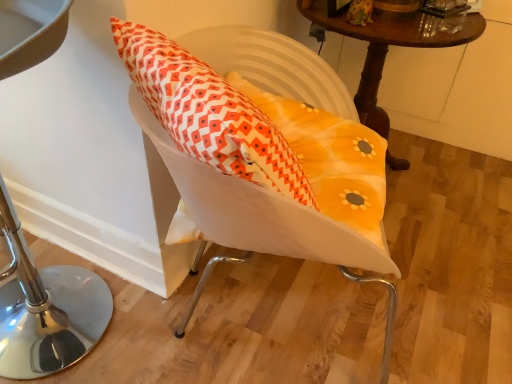
Image resolution: width=512 pixels, height=384 pixels. Find the location of `wooden table at upper right`. wooden table at upper right is located at coordinates (391, 44).

From the picture: Would you say metallic stool at left is inside or outside white fabric swivel chair at center?

metallic stool at left cannot be found inside white fabric swivel chair at center.

Considering the sizes of objects metallic stool at left and white fabric swivel chair at center in the image provided, who is bigger, metallic stool at left or white fabric swivel chair at center?

Bigger between the two is metallic stool at left.

Is metallic stool at left facing towards white fabric swivel chair at center?

No.

Considering the positions of objects metallic stool at left and white fabric swivel chair at center in the image provided, who is more to the right, metallic stool at left or white fabric swivel chair at center?

white fabric swivel chair at center.

Is white fabric swivel chair at center not inside wooden table at upper right?

Yes.

From a real-world perspective, is white fabric swivel chair at center above or below wooden table at upper right?

white fabric swivel chair at center is above wooden table at upper right.

Considering the positions of objects white fabric swivel chair at center and wooden table at upper right in the image provided, who is in front, white fabric swivel chair at center or wooden table at upper right?

white fabric swivel chair at center is more forward.

Would you say white fabric swivel chair at center is outside metallic stool at left?

Yes, white fabric swivel chair at center is outside of metallic stool at left.

From the picture: Who is smaller, white fabric swivel chair at center or metallic stool at left?

Smaller between the two is white fabric swivel chair at center.

Considering the positions of points (260, 105) and (56, 20), is point (260, 105) farther from camera compared to point (56, 20)?

Yes, point (260, 105) is behind point (56, 20).

Does wooden table at upper right appear on the left side of metallic stool at left?

No.

Choose the correct answer: Is wooden table at upper right inside metallic stool at left or outside it?

wooden table at upper right lies outside metallic stool at left.

Is point (447, 23) closer or farther from the camera than point (48, 323)?

Clearly, point (447, 23) is more distant from the camera than point (48, 323).

From the image's perspective, which one is positioned lower, wooden table at upper right or metallic stool at left?

metallic stool at left appears lower in the image.

From the image's perspective, which is above, metallic stool at left or wooden table at upper right?

wooden table at upper right, from the image's perspective.

The height and width of the screenshot is (384, 512). Identify the location of table behind the metallic stool at left. (391, 44).

Which of these two, metallic stool at left or wooden table at upper right, stands shorter?

Standing shorter between the two is wooden table at upper right.

Is wooden table at upper right located outside white fabric swivel chair at center?

Yes, wooden table at upper right is outside of white fabric swivel chair at center.

Considering the positions of objects wooden table at upper right and white fabric swivel chair at center in the image provided, who is in front, wooden table at upper right or white fabric swivel chair at center?

white fabric swivel chair at center is in front.

Can you tell me how much wooden table at upper right and white fabric swivel chair at center differ in facing direction?

20.7 degrees separate the facing orientations of wooden table at upper right and white fabric swivel chair at center.

Locate an element on the screen. This screenshot has height=384, width=512. table directly beneath the white fabric swivel chair at center (from a real-world perspective) is located at coordinates (391, 44).

I want to click on furniture behind the white fabric swivel chair at center, so pyautogui.click(x=45, y=308).

Where is `swivel chair below the wooden table at upper right (from the image's perspective)`? The image size is (512, 384). swivel chair below the wooden table at upper right (from the image's perspective) is located at coordinates (296, 153).

Estimate the real-world distances between objects in this image. Which object is further from white fabric swivel chair at center, metallic stool at left or wooden table at upper right?

metallic stool at left is further to white fabric swivel chair at center.

When comparing their distances from wooden table at upper right, does metallic stool at left or white fabric swivel chair at center seem further?

Among the two, metallic stool at left is located further to wooden table at upper right.

Based on their spatial positions, is wooden table at upper right or white fabric swivel chair at center further from metallic stool at left?

wooden table at upper right.

Based on their spatial positions, is white fabric swivel chair at center or wooden table at upper right further from metallic stool at left?

wooden table at upper right lies further to metallic stool at left than the other object.

From the image, which object appears to be farther from white fabric swivel chair at center, wooden table at upper right or metallic stool at left?

metallic stool at left is positioned further to the anchor white fabric swivel chair at center.

Based on their spatial positions, is white fabric swivel chair at center or metallic stool at left closer to wooden table at upper right?

Based on the image, white fabric swivel chair at center appears to be nearer to wooden table at upper right.

You are a GUI agent. You are given a task and a screenshot of the screen. Output one action in this format:
    pyautogui.click(x=<x>, y=<y>)
    Task: Click on the swivel chair situated between metallic stool at left and wooden table at upper right from left to right
    This screenshot has height=384, width=512.
    Given the screenshot: What is the action you would take?
    pyautogui.click(x=296, y=153)